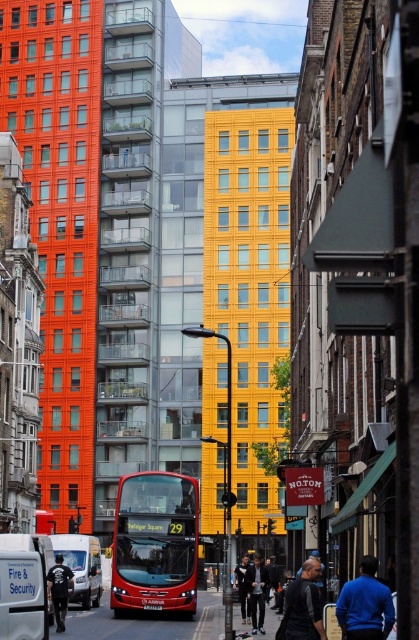
Does dark blue jacket at center have a greater height compared to black cotton shirt at lower left?

Indeed, dark blue jacket at center has a greater height compared to black cotton shirt at lower left.

Is point (277, 637) farther from viewer compared to point (56, 627)?

That is False.

The width and height of the screenshot is (419, 640). In order to click on dark blue jacket at center in this screenshot , I will do `click(302, 605)`.

Where is `dark blue jacket at center`? dark blue jacket at center is located at coordinates (302, 605).

Is smooth asphalt road at center thinner than black cotton shirt at lower left?

No, smooth asphalt road at center is not thinner than black cotton shirt at lower left.

Between point (129, 621) and point (48, 576), which one is positioned in front?

Positioned in front is point (48, 576).

You are a GUI agent. You are given a task and a screenshot of the screen. Output one action in this format:
    pyautogui.click(x=<x>, y=<y>)
    Task: Click on the smooth asphalt road at center
    The image size is (419, 640).
    Given the screenshot: What is the action you would take?
    pyautogui.click(x=144, y=621)

Based on the photo, between smooth asphalt road at center and blue sweater at lower right, which one is positioned higher?

Positioned higher is blue sweater at lower right.

Who is more forward, [157,632] or [380,589]?

Positioned in front is point [380,589].

At what (x,y) coordinates should I click in order to perform the action: click on smooth asphalt road at center. Please return your answer as a coordinate pair (x, y). This screenshot has width=419, height=640. Looking at the image, I should click on (144, 621).